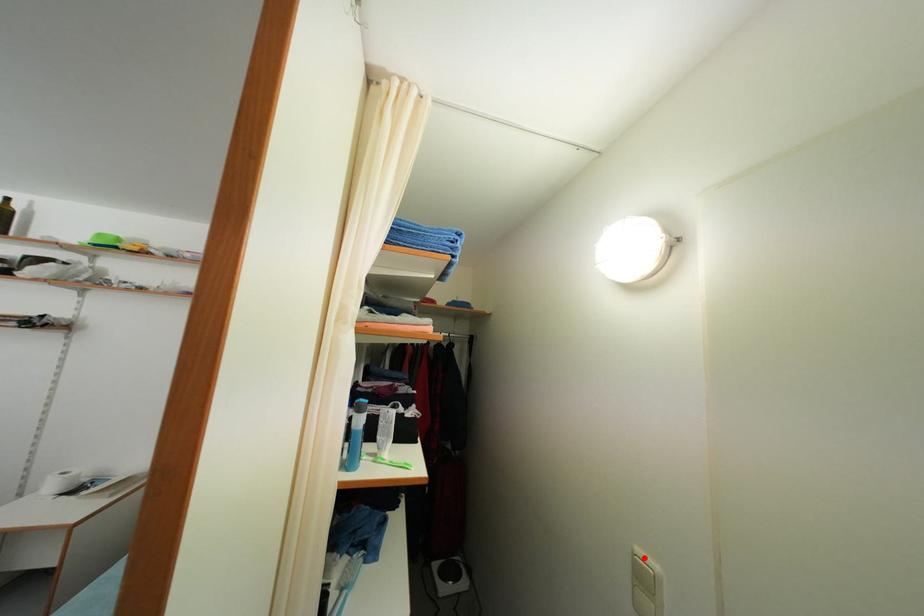
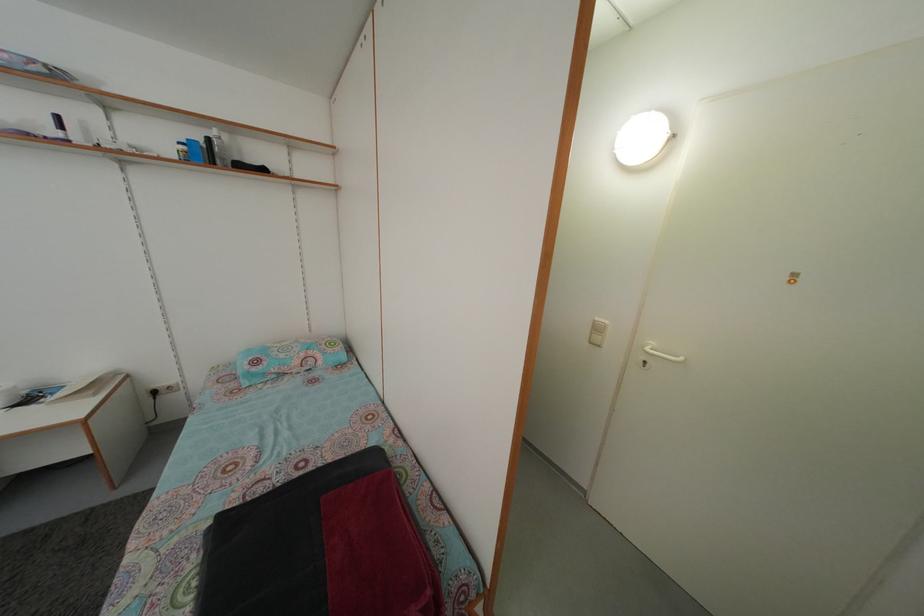
Find the pixel in the second image that matches the highlighted location in the first image.

(602, 326)